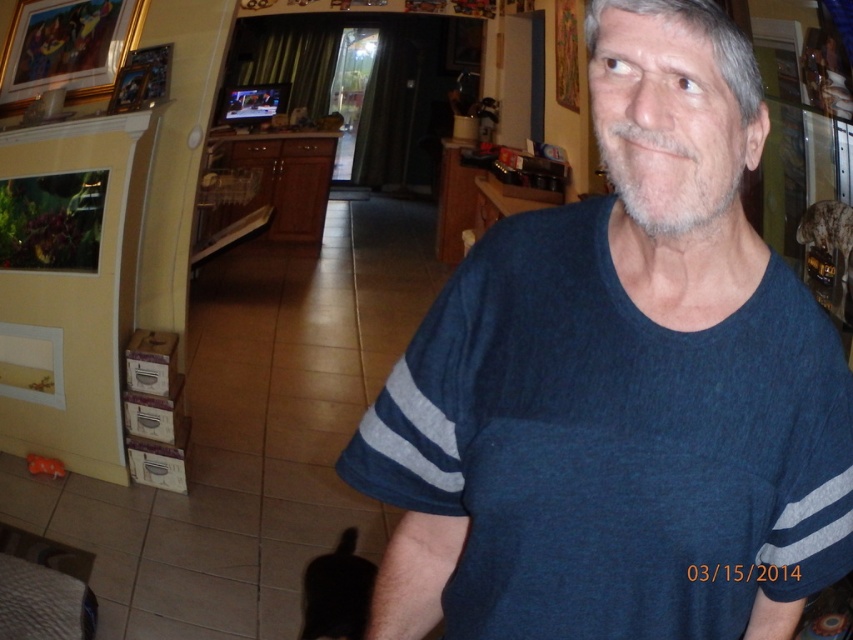
Question: Among these points, which one is nearest to the camera?

Choices:
 (A) tap(457, 387)
 (B) tap(22, 616)

Answer: (A)

Question: Is blue heathered t-shirt at center wider than matte plastic bag at lower left?

Choices:
 (A) yes
 (B) no

Answer: (A)

Question: Which point appears closest to the camera in this image?

Choices:
 (A) (10, 596)
 (B) (753, 461)

Answer: (B)

Question: Observing the image, what is the correct spatial positioning of blue heathered t-shirt at center in reference to matte plastic bag at lower left?

Choices:
 (A) above
 (B) below

Answer: (A)

Question: Is blue heathered t-shirt at center thinner than matte plastic bag at lower left?

Choices:
 (A) no
 (B) yes

Answer: (A)